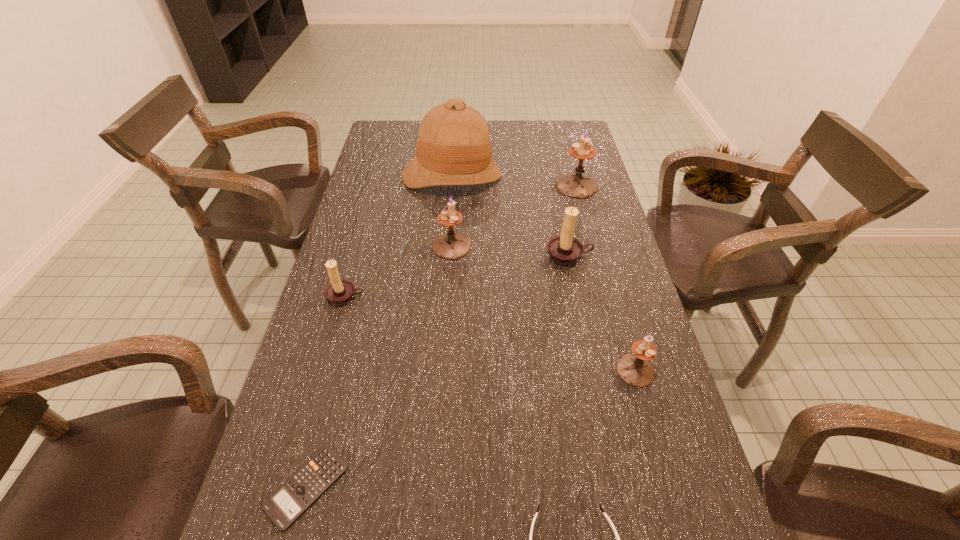
Where is `the nearer brown candle holder`? This screenshot has height=540, width=960. the nearer brown candle holder is located at coordinates [340, 291].

The width and height of the screenshot is (960, 540). In order to click on the shortest object in this screenshot , I will do `click(305, 486)`.

This screenshot has height=540, width=960. What are the coordinates of `free space located 0.090m on the front-facing side of the tallest object` in the screenshot? It's located at (448, 217).

I want to click on free space located on the back of the tallest candle holder, so click(x=567, y=150).

Find the location of a particular element. This screenshot has height=540, width=960. vacant space located on the right of the second farthest purple candle holder is located at coordinates (585, 246).

The image size is (960, 540). Find the location of `vacant space situated 0.200m on the wick of the right brown candle holder`. vacant space situated 0.200m on the wick of the right brown candle holder is located at coordinates (584, 327).

Where is `vacant space located 0.140m on the back of the nearest purple candle holder`? This screenshot has height=540, width=960. vacant space located 0.140m on the back of the nearest purple candle holder is located at coordinates pos(617,307).

The width and height of the screenshot is (960, 540). In order to click on vacant region located 0.100m on the wick of the fifth farthest object in this screenshot , I will do `click(333, 341)`.

You are a GUI agent. You are given a task and a screenshot of the screen. Output one action in this format:
    pyautogui.click(x=<x>, y=<y>)
    Task: Click on the free location located on the back of the shortest object
    The width and height of the screenshot is (960, 540).
    Given the screenshot: What is the action you would take?
    pyautogui.click(x=357, y=293)

Locate an element on the screen. The height and width of the screenshot is (540, 960). hat located at the left edge is located at coordinates (453, 148).